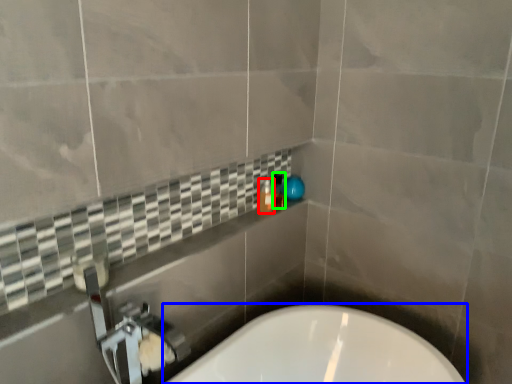
Question: Estimate the real-world distances between objects in this image. Which object is farther from bottle (highlighted by a red box), bathtub (highlighted by a blue box) or toiletry (highlighted by a green box)?

Choices:
 (A) bathtub
 (B) toiletry

Answer: (A)